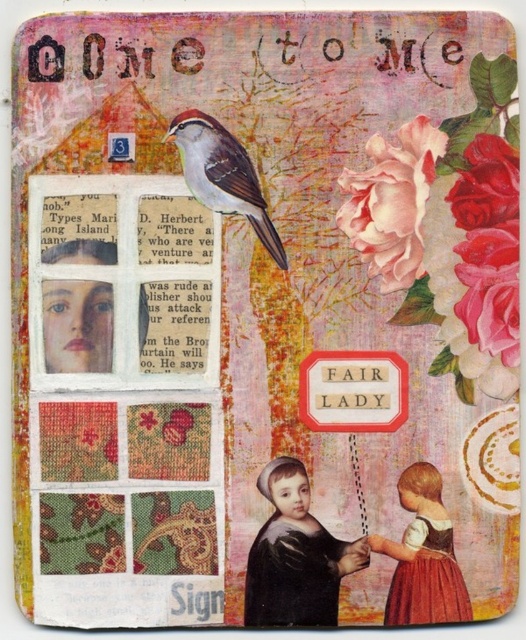
You are an art curator analyzing the composition of this vibrant collage. The artwork has a point at coordinate (296, 556). Which object in the scene is located at that position?

The point at coordinate (296, 556) corresponds to the matte black portrait at center.

You are an art curator planning to hang a new painting between the matte black portrait at center and the matte brown dress at lower right. Based on their positions, which object should the new painting be placed closer to?

The new painting should be placed closer to the matte brown dress at lower right because it is behind the matte black portrait at center, so the space between them allows for placement near the dress.